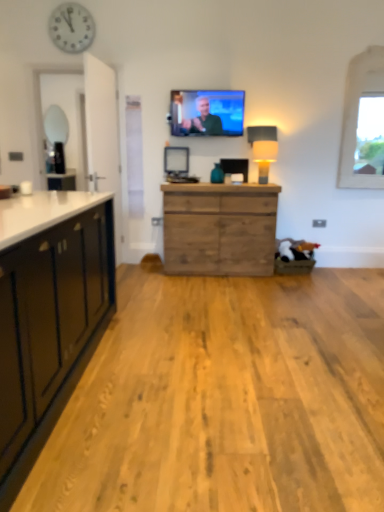
Question: Is there a large distance between white fabric lampshade at right and wooden chest of drawers at center?

Choices:
 (A) yes
 (B) no

Answer: (B)

Question: Is white fabric lampshade at right shorter than wooden chest of drawers at center?

Choices:
 (A) no
 (B) yes

Answer: (B)

Question: Is white fabric lampshade at right smaller than wooden chest of drawers at center?

Choices:
 (A) no
 (B) yes

Answer: (B)

Question: Is wooden chest of drawers at center surrounded by white fabric lampshade at right?

Choices:
 (A) no
 (B) yes

Answer: (A)

Question: From a real-world perspective, is white fabric lampshade at right over wooden chest of drawers at center?

Choices:
 (A) no
 (B) yes

Answer: (B)

Question: Is white fabric lampshade at right positioned with its back to wooden chest of drawers at center?

Choices:
 (A) no
 (B) yes

Answer: (A)

Question: From the image's perspective, would you say wooden chest of drawers at center is shown under white fabric lampshade at right?

Choices:
 (A) yes
 (B) no

Answer: (A)

Question: Considering the relative positions of wooden chest of drawers at center and white fabric lampshade at right in the image provided, is wooden chest of drawers at center to the left of white fabric lampshade at right from the viewer's perspective?

Choices:
 (A) yes
 (B) no

Answer: (A)

Question: Considering the relative positions of wooden chest of drawers at center and white fabric lampshade at right in the image provided, is wooden chest of drawers at center to the right of white fabric lampshade at right from the viewer's perspective?

Choices:
 (A) yes
 (B) no

Answer: (B)

Question: Is white fabric lampshade at right surrounded by wooden chest of drawers at center?

Choices:
 (A) yes
 (B) no

Answer: (B)

Question: Is wooden chest of drawers at center positioned beyond the bounds of white fabric lampshade at right?

Choices:
 (A) yes
 (B) no

Answer: (A)

Question: From the image's perspective, is wooden chest of drawers at center located above white fabric lampshade at right?

Choices:
 (A) no
 (B) yes

Answer: (A)

Question: Can you confirm if white fabric lampshade at right is positioned to the right of white stone window at upper right?

Choices:
 (A) no
 (B) yes

Answer: (A)